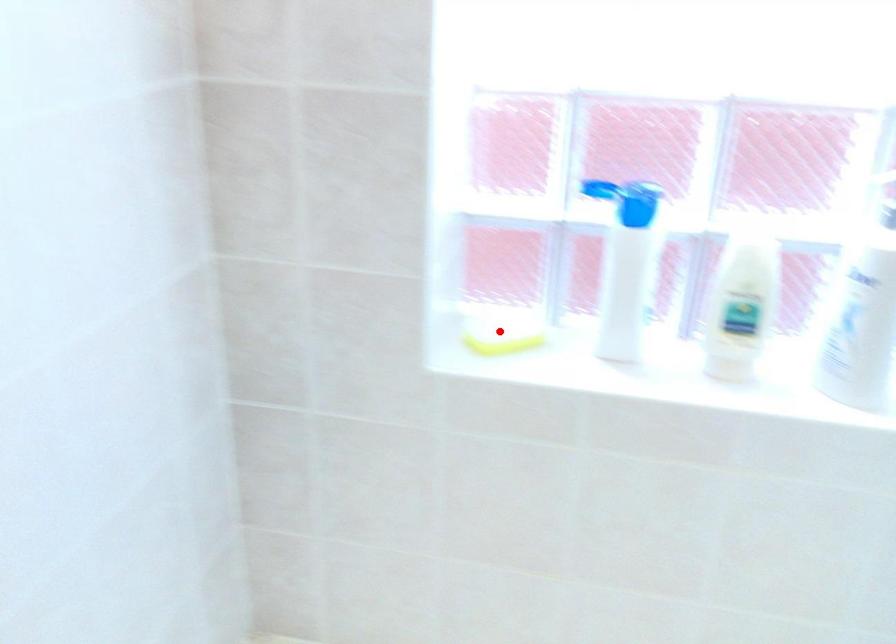
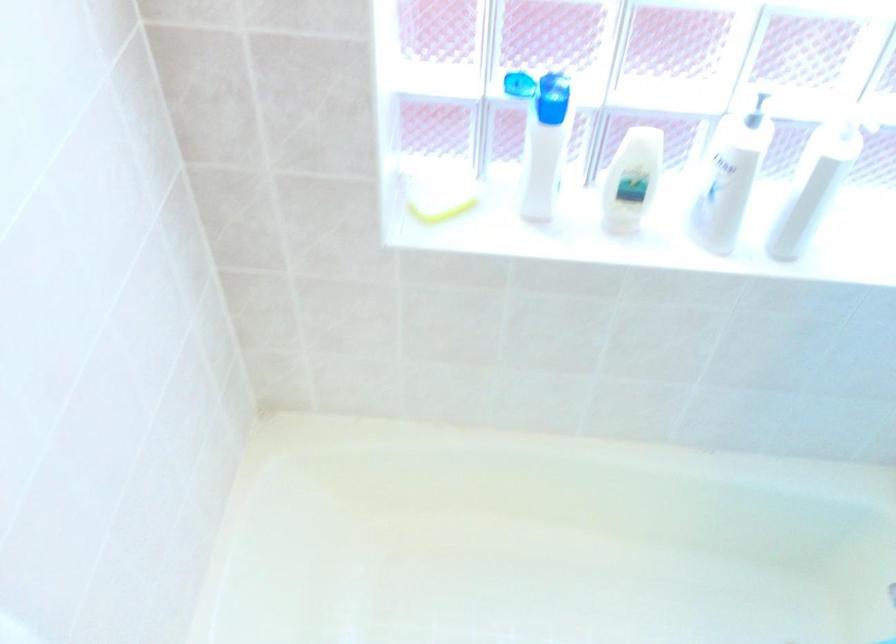
In the second image, find the point that corresponds to the highlighted location in the first image.

(438, 196)